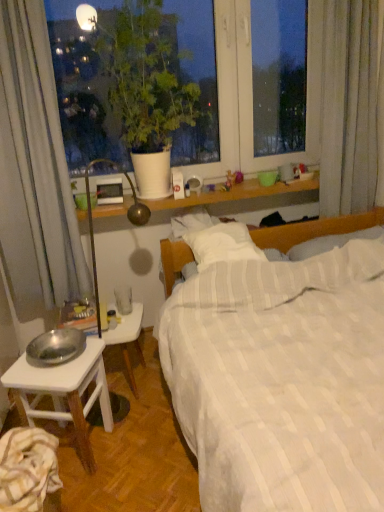
Question: Does white wooden table at lower left have a lesser width compared to silver metallic bowl at lower left?

Choices:
 (A) no
 (B) yes

Answer: (B)

Question: Is white wooden table at lower left turned away from silver metallic bowl at lower left?

Choices:
 (A) no
 (B) yes

Answer: (A)

Question: From the image's perspective, is white wooden table at lower left located beneath silver metallic bowl at lower left?

Choices:
 (A) no
 (B) yes

Answer: (A)

Question: Are white wooden table at lower left and silver metallic bowl at lower left beside each other?

Choices:
 (A) no
 (B) yes

Answer: (A)

Question: From a real-world perspective, does white wooden table at lower left sit lower than silver metallic bowl at lower left?

Choices:
 (A) no
 (B) yes

Answer: (B)

Question: From a real-world perspective, is silver metallic bowl at lower left above or below metallic silver bowl at lower left?

Choices:
 (A) above
 (B) below

Answer: (B)

Question: Is silver metallic bowl at lower left wider or thinner than metallic silver bowl at lower left?

Choices:
 (A) wide
 (B) thin

Answer: (A)

Question: From their relative heights in the image, would you say silver metallic bowl at lower left is taller or shorter than metallic silver bowl at lower left?

Choices:
 (A) tall
 (B) short

Answer: (A)

Question: Considering the relative positions of silver metallic bowl at lower left and metallic silver bowl at lower left in the image provided, is silver metallic bowl at lower left to the left or to the right of metallic silver bowl at lower left?

Choices:
 (A) right
 (B) left

Answer: (A)

Question: Is silver metallic bowl at lower left taller or shorter than white wooden table at lower left?

Choices:
 (A) short
 (B) tall

Answer: (B)

Question: From a real-world perspective, is silver metallic bowl at lower left positioned above or below white wooden table at lower left?

Choices:
 (A) above
 (B) below

Answer: (A)

Question: Is silver metallic bowl at lower left spatially inside white wooden table at lower left, or outside of it?

Choices:
 (A) outside
 (B) inside

Answer: (A)

Question: From the image's perspective, is silver metallic bowl at lower left above or below white wooden table at lower left?

Choices:
 (A) below
 (B) above

Answer: (A)

Question: From the image's perspective, is striped cotton sheet at lower left above or below white matte plant pot at upper left?

Choices:
 (A) below
 (B) above

Answer: (A)

Question: From a real-world perspective, is striped cotton sheet at lower left positioned above or below white matte plant pot at upper left?

Choices:
 (A) above
 (B) below

Answer: (B)